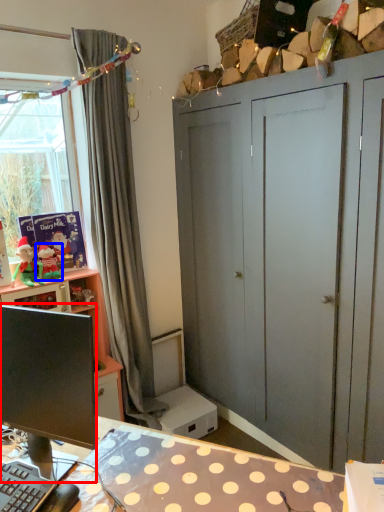
Question: Which object appears farthest to the camera in this image, computer monitor (highlighted by a red box) or toy (highlighted by a blue box)?

Choices:
 (A) computer monitor
 (B) toy

Answer: (B)